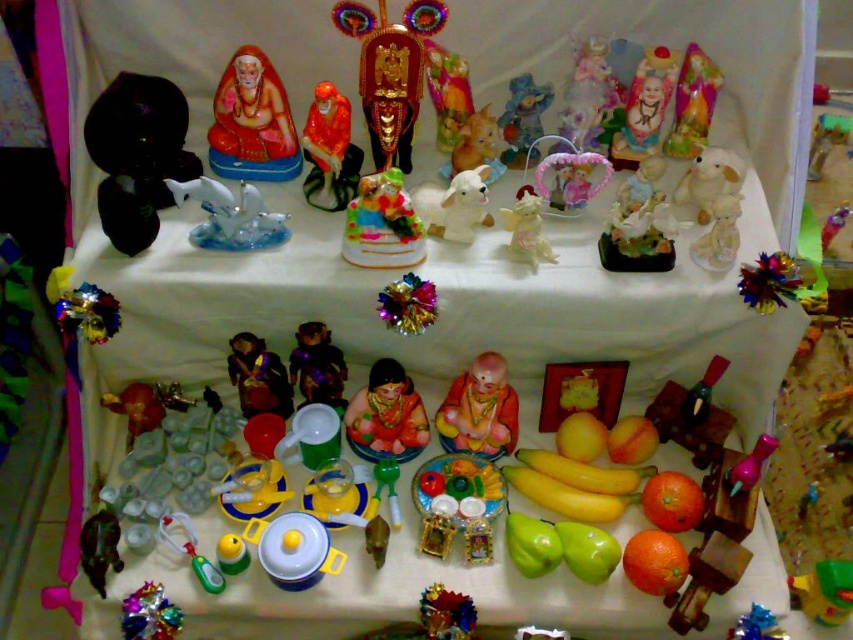
You are a customer at a craft fair and see the matte ceramic statue at upper center on the top table. You want to place a small gift box between it and another item. Is there enough space for the gift box?

The matte ceramic statue at upper center and the other item are 1.27 meters apart, so yes, there is enough space to place a small gift box between them.

What is located at point (252, 122)?

A matte ceramic statue at upper center is located at point (252, 122).

You are at a market stall and see the white glossy figurine at center and the orange matte at lower right. Which one is positioned to the left?

The white glossy figurine at center is positioned to the left of the orange matte at lower right.